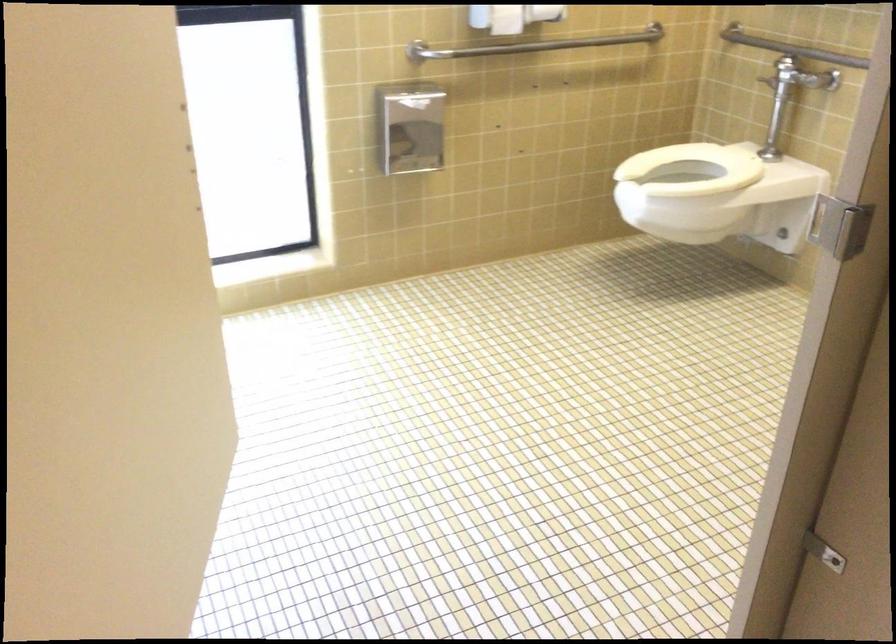
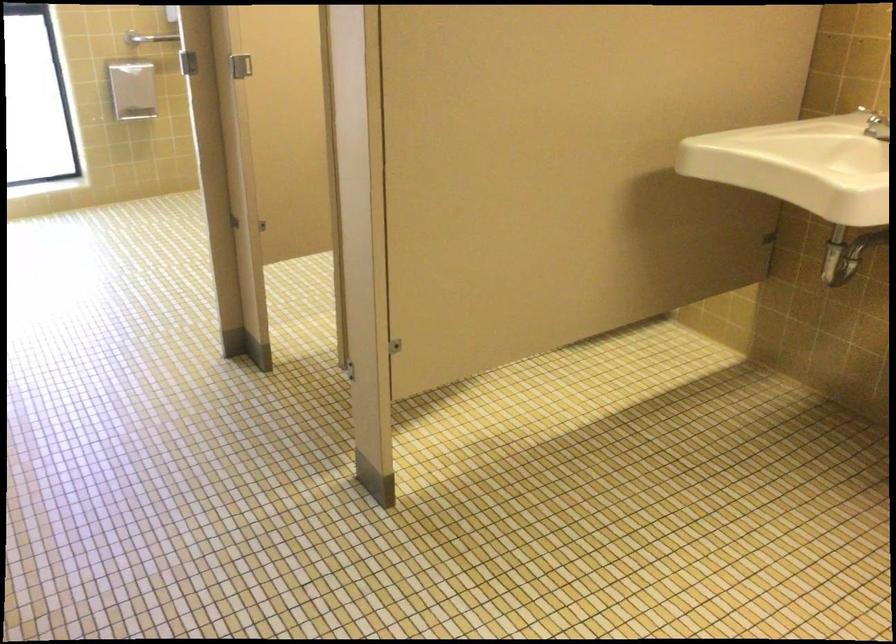
Question: I am providing you with two images of the same scene from different viewpoints. Please identify which objects are invisible in image2.

Choices:
 (A) metal stall latch
 (B) blue q-tips box
 (C) white toilet seat
 (D) metal grab bar

Answer: (C)